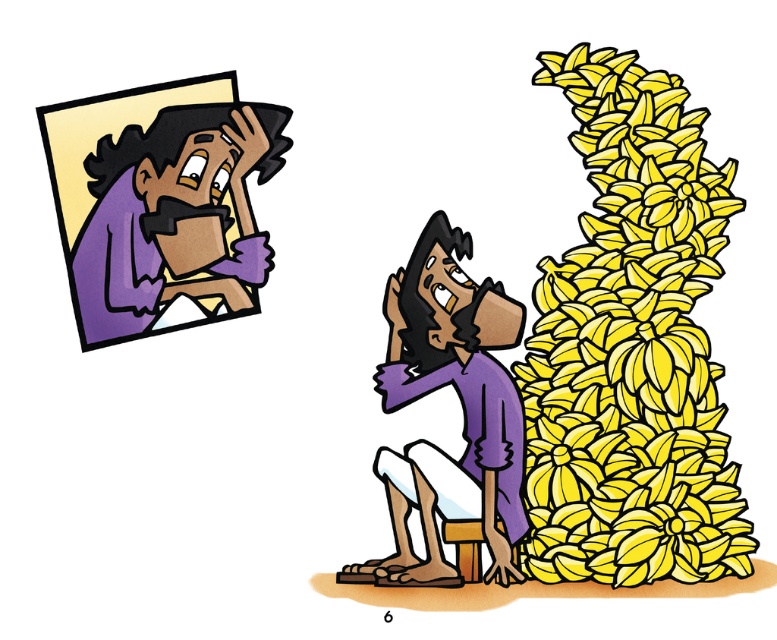
In the scene shown: Is yellow matte bananas at right positioned at the back of purple matte headscarf at upper left?

No.

Which of these two, yellow matte bananas at right or purple matte headscarf at upper left, stands taller?

yellow matte bananas at right

This screenshot has height=640, width=777. I want to click on yellow matte bananas at right, so click(x=629, y=346).

Is yellow matte bananas at right closer to the viewer compared to purple matte/silk shirt at center?

Yes.

Does yellow matte bananas at right have a larger size compared to purple matte/silk shirt at center?

Yes, yellow matte bananas at right is bigger than purple matte/silk shirt at center.

I want to click on yellow matte bananas at right, so click(x=629, y=346).

Does point (183, 228) come in front of point (504, 531)?

No, it is not.

Can you confirm if purple matte headscarf at upper left is shorter than purple matte/silk shirt at center?

Indeed, purple matte headscarf at upper left has a lesser height compared to purple matte/silk shirt at center.

What do you see at coordinates (176, 216) in the screenshot?
I see `purple matte headscarf at upper left` at bounding box center [176, 216].

This screenshot has height=640, width=777. In order to click on purple matte headscarf at upper left in this screenshot , I will do `click(176, 216)`.